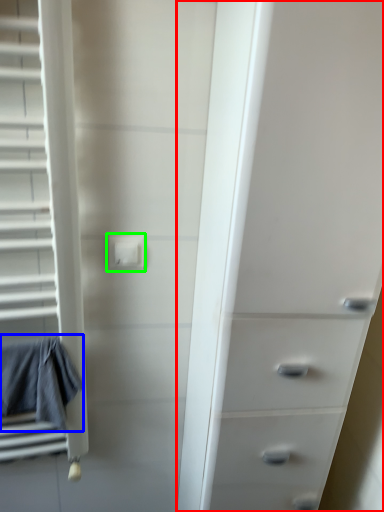
Question: Estimate the real-world distances between objects in this image. Which object is closer to chest of drawers (highlighted by a red box), bath towel (highlighted by a blue box) or electric outlet (highlighted by a green box)?

Choices:
 (A) bath towel
 (B) electric outlet

Answer: (B)